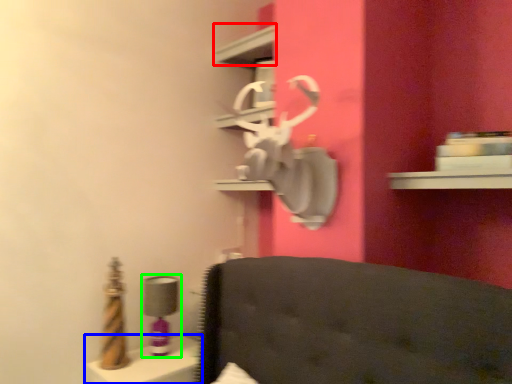
Question: Which object is positioned closest to shelf (highlighted by a red box)? Select from vanity (highlighted by a blue box) and table lamp (highlighted by a green box).

Choices:
 (A) vanity
 (B) table lamp

Answer: (B)